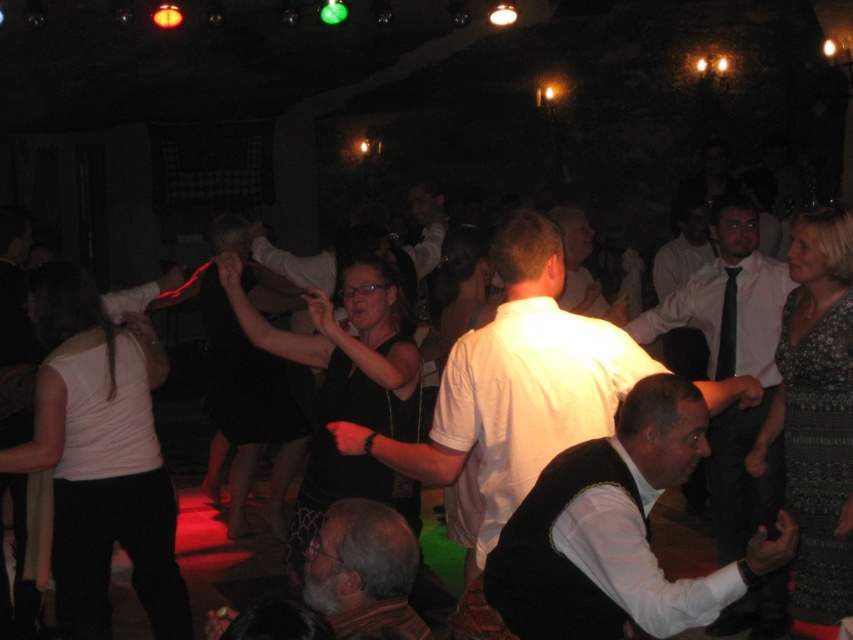
You are a photographer at the event and want to capture both the white matte vest at center and the gray hair at lower center in the same frame. Which object should you focus on first to ensure both are in focus?

You should focus on the white matte vest at center first because it is larger in size compared to the gray hair at lower center, making it easier to achieve sharp focus on the larger object before adjusting for the smaller one.

You are at a party and want to take a photo of both the white matte shirt at center and the gray hair at lower center. Which object should you focus on first to ensure both are in frame?

The white matte shirt at center is taller than the gray hair at lower center, so you should focus on the white matte shirt at center first to ensure both are in frame.

In the scene shown: You are a photographer at the party and want to capture a photo of both the white matte vest at center and the white shirt at center. Since the lighting is dim, you need to ensure both are visible. Which object is positioned lower in the frame to better catch the light?

The white matte vest at center is below the white shirt at center, so it is positioned lower in the frame and may catch more light from below.